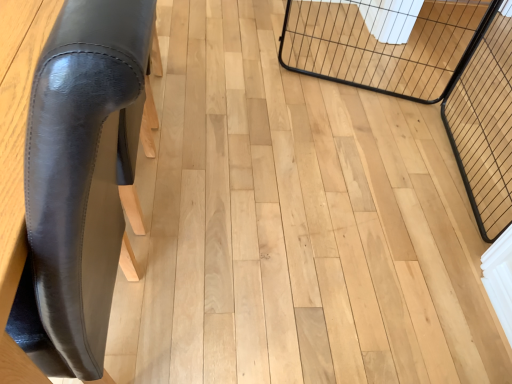
Question: From the image's perspective, is black wire mesh cage at right, which ranks as the 1th cage in right-to-left order, under black wire cage at upper right, acting as the 1th cage starting from the left?

Choices:
 (A) yes
 (B) no

Answer: (A)

Question: Is black wire cage at upper right, the second cage in the right-to-left sequence, a part of black wire mesh cage at right, which ranks as the 1th cage in right-to-left order?

Choices:
 (A) no
 (B) yes

Answer: (A)

Question: Can we say black wire mesh cage at right, the second cage in the left-to-right sequence, lies outside black wire cage at upper right, acting as the 1th cage starting from the left?

Choices:
 (A) yes
 (B) no

Answer: (A)

Question: Is black wire mesh cage at right, which ranks as the 1th cage in right-to-left order, turned away from black wire cage at upper right, acting as the 1th cage starting from the left?

Choices:
 (A) no
 (B) yes

Answer: (A)

Question: Can you confirm if black wire mesh cage at right, which ranks as the 1th cage in right-to-left order, is thinner than black wire cage at upper right, the second cage in the right-to-left sequence?

Choices:
 (A) yes
 (B) no

Answer: (B)

Question: From a real-world perspective, relative to black leather chair at left, is black wire cage at upper right, the second cage in the right-to-left sequence, vertically above or below?

Choices:
 (A) below
 (B) above

Answer: (A)

Question: From the image's perspective, relative to black leather chair at left, is black wire cage at upper right, the second cage in the right-to-left sequence, above or below?

Choices:
 (A) below
 (B) above

Answer: (B)

Question: Looking at their shapes, would you say black wire cage at upper right, the second cage in the right-to-left sequence, is wider or thinner than black leather chair at left?

Choices:
 (A) wide
 (B) thin

Answer: (B)

Question: Based on their sizes in the image, would you say black wire cage at upper right, acting as the 1th cage starting from the left, is bigger or smaller than black leather chair at left?

Choices:
 (A) small
 (B) big

Answer: (A)

Question: In terms of size, does black leather chair at left appear bigger or smaller than black wire mesh cage at right, the second cage in the left-to-right sequence?

Choices:
 (A) small
 (B) big

Answer: (B)

Question: Is point (52, 56) positioned closer to the camera than point (468, 71)?

Choices:
 (A) closer
 (B) farther

Answer: (A)

Question: In the image, is black leather chair at left positioned in front of or behind black wire mesh cage at right, the second cage in the left-to-right sequence?

Choices:
 (A) front
 (B) behind

Answer: (A)

Question: From their relative heights in the image, would you say black leather chair at left is taller or shorter than black wire mesh cage at right, the second cage in the left-to-right sequence?

Choices:
 (A) short
 (B) tall

Answer: (B)

Question: In terms of width, does black wire mesh cage at right, which ranks as the 1th cage in right-to-left order, look wider or thinner when compared to black wire cage at upper right, acting as the 1th cage starting from the left?

Choices:
 (A) thin
 (B) wide

Answer: (B)

Question: Does point (465, 69) appear closer or farther from the camera than point (406, 81)?

Choices:
 (A) farther
 (B) closer

Answer: (A)